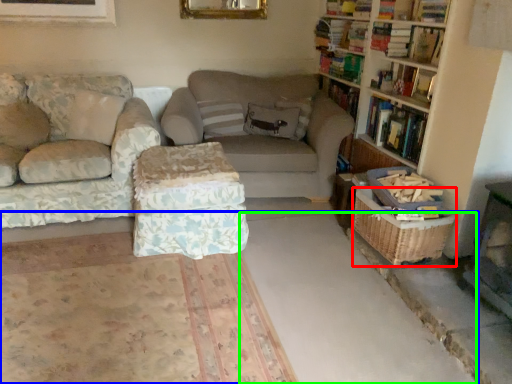
Question: Based on their relative distances, which object is farther from basket (highlighted by a red box)? Choose from concrete (highlighted by a blue box) and concrete (highlighted by a green box).

Choices:
 (A) concrete
 (B) concrete

Answer: (B)